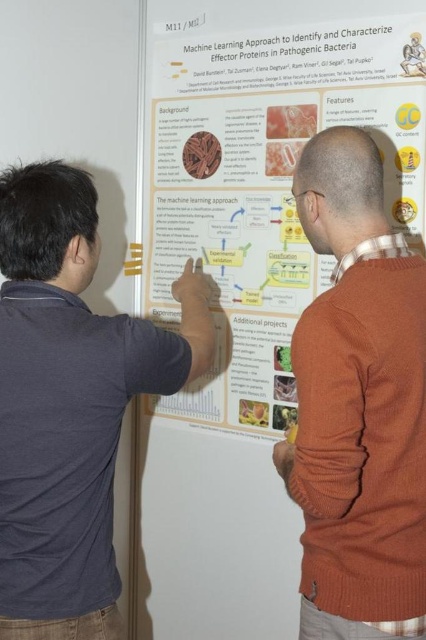
Question: Among these objects, which one is farthest from the camera?

Choices:
 (A) white paper poster at center
 (B) dark blue shirt at left
 (C) orange sweater at right

Answer: (A)

Question: Among these objects, which one is nearest to the camera?

Choices:
 (A) orange sweater at right
 (B) white paper poster at center

Answer: (A)

Question: Among these points, which one is farthest from the camera?

Choices:
 (A) (386, 33)
 (B) (83, 509)
 (C) (414, 602)

Answer: (A)

Question: Does white paper poster at center have a larger size compared to dark blue shirt at left?

Choices:
 (A) yes
 (B) no

Answer: (A)

Question: Does white paper poster at center appear over orange sweater at right?

Choices:
 (A) yes
 (B) no

Answer: (A)

Question: Is white paper poster at center to the right of orange sweater at right from the viewer's perspective?

Choices:
 (A) yes
 (B) no

Answer: (B)